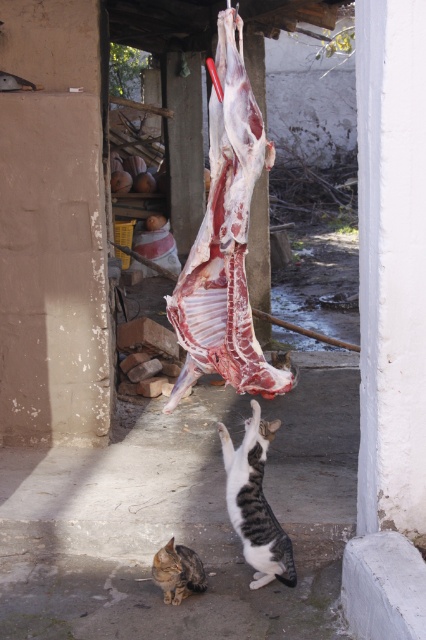
Question: Where is tabby fur cat at center located in relation to tabby fur cat at lower center in the image?

Choices:
 (A) below
 (B) above

Answer: (B)

Question: Which object is closer to the camera taking this photo?

Choices:
 (A) tabby fur cat at center
 (B) tabby fur cat at lower center

Answer: (A)

Question: Is tabby fur cat at center above tabby fur cat at lower center?

Choices:
 (A) yes
 (B) no

Answer: (A)

Question: Where is tabby fur cat at center located in relation to tabby fur cat at lower center in the image?

Choices:
 (A) left
 (B) right

Answer: (B)